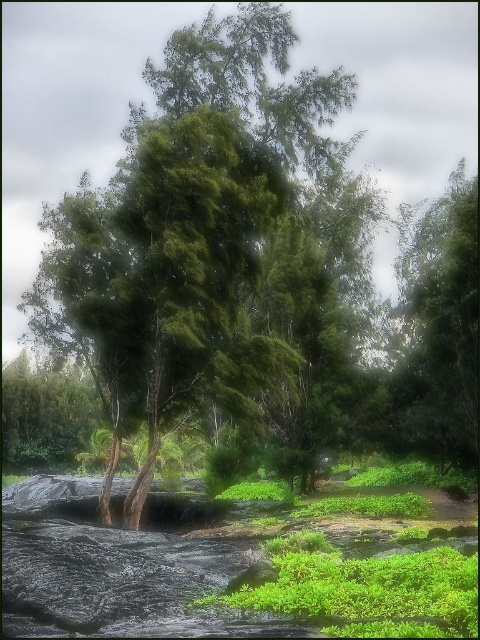
Is green mossy rock at lower center smaller than green leafy tree at right?

Incorrect, green mossy rock at lower center is not smaller in size than green leafy tree at right.

Who is higher up, green mossy rock at lower center or green leafy tree at right?

green leafy tree at right is above.

Is point (9, 524) positioned behind point (408, 296)?

No, it is in front of (408, 296).

Identify the location of green mossy rock at lower center. (219, 570).

Can you confirm if green leafy tree at center is positioned above green mossy rock at lower center?

Correct, green leafy tree at center is located above green mossy rock at lower center.

Between green leafy tree at center and green mossy rock at lower center, which one is positioned lower?

green mossy rock at lower center is lower down.

Who is more distant from viewer, (240, 378) or (309, 604)?

Positioned behind is point (240, 378).

The height and width of the screenshot is (640, 480). In order to click on green leafy tree at center in this screenshot , I will do `click(199, 230)`.

Is the position of green leafy tree at center less distant than that of green leafy tree at right?

Yes, green leafy tree at center is closer to the viewer.

Does point (271, 138) come behind point (463, 289)?

No.

Image resolution: width=480 pixels, height=640 pixels. Identify the location of green leafy tree at center. (199, 230).